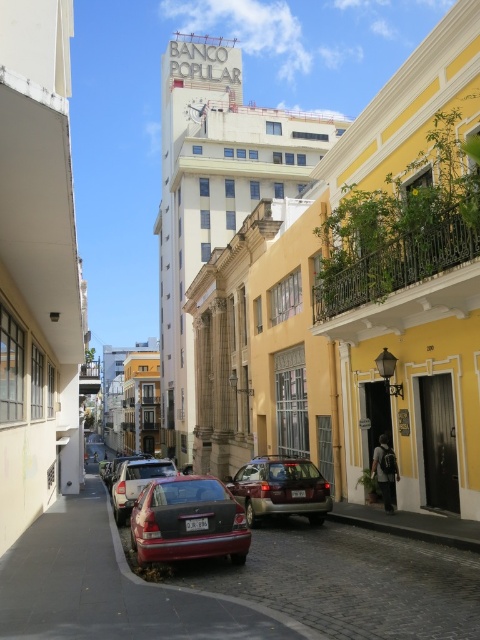
You are a delivery person needing to park your motorcycle between the matte gray suv at center and the matte red car at center. Which vehicle should you position your motorcycle closer to if you want to maximize available parking space?

You should position your motorcycle closer to the matte gray suv at center because it occupies less space than the matte red car at center, leaving more room for the motorcycle.

You are standing at the entrance of the yellow building on the right. You want to walk to the shiny red sedan at lower center. Which direction should you walk? The street is narrow and has parked cars. Please choose between left or right.

You should walk to the left because the shiny red sedan at lower center is located at point [188,522], which is on the left side of the entrance of the yellow building on the right.

You are a delivery person needing to park your vehicle near the historic buildings. You have a matte gray suv at center and a matte red car at center. Which vehicle should you choose to park closer to the entrance of the yellow building on the right?

The matte gray suv at center is closer to the viewer than the matte red car at center, so you should choose the matte gray suv at center to park closer to the entrance of the yellow building on the right.